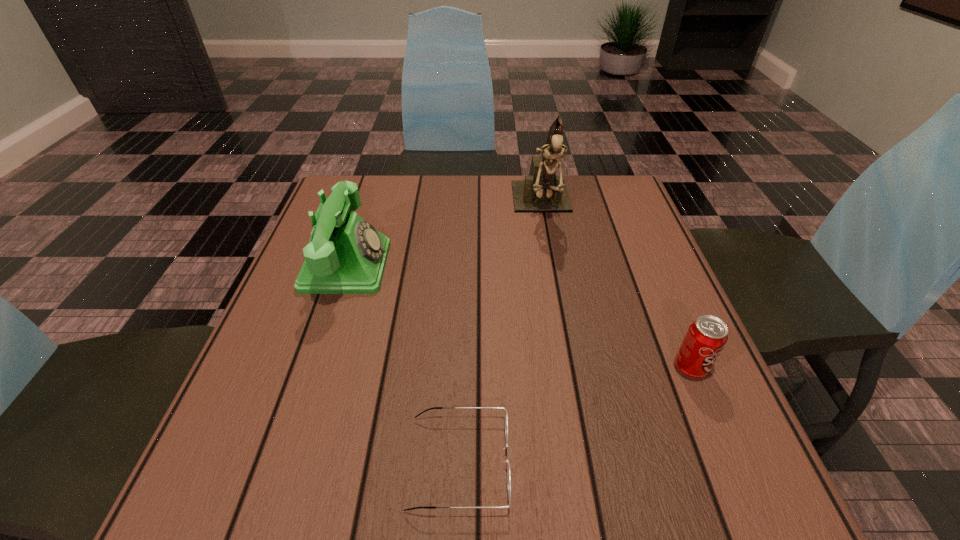
In the image, there is a desktop. Identify the location of free space at the near right corner. (739, 503).

Locate an element on the screen. The width and height of the screenshot is (960, 540). free spot between the second object from right to left and the nearest object is located at coordinates (501, 334).

Where is `vacant area that lies between the tallest object and the shortest object`? The image size is (960, 540). vacant area that lies between the tallest object and the shortest object is located at coordinates (501, 334).

I want to click on free space between the telephone and the soda, so click(x=518, y=317).

Identify the location of vacant area that lies between the rightmost object and the figurine. The width and height of the screenshot is (960, 540). (616, 287).

Image resolution: width=960 pixels, height=540 pixels. In order to click on vacant space in between the third object from right to left and the second object from right to left in this screenshot , I will do `click(501, 334)`.

What are the coordinates of `vacant area that lies between the second object from right to left and the telephone` in the screenshot? It's located at (444, 236).

Where is `free space between the second object from left to right and the leftmost object`? The height and width of the screenshot is (540, 960). free space between the second object from left to right and the leftmost object is located at coordinates (403, 364).

You are a GUI agent. You are given a task and a screenshot of the screen. Output one action in this format:
    pyautogui.click(x=<x>, y=<y>)
    Task: Click on the empty space that is in between the nearest object and the third shortest object
    
    Given the screenshot: What is the action you would take?
    pyautogui.click(x=403, y=364)

This screenshot has width=960, height=540. I want to click on vacant space that is in between the figurine and the second object from left to right, so click(501, 334).